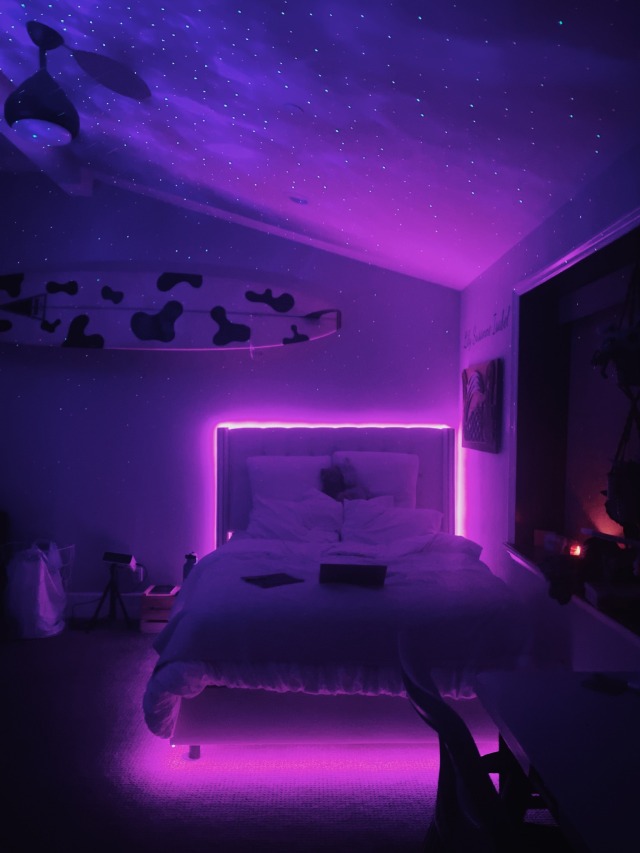
This screenshot has height=853, width=640. I want to click on comforter, so click(292, 669).